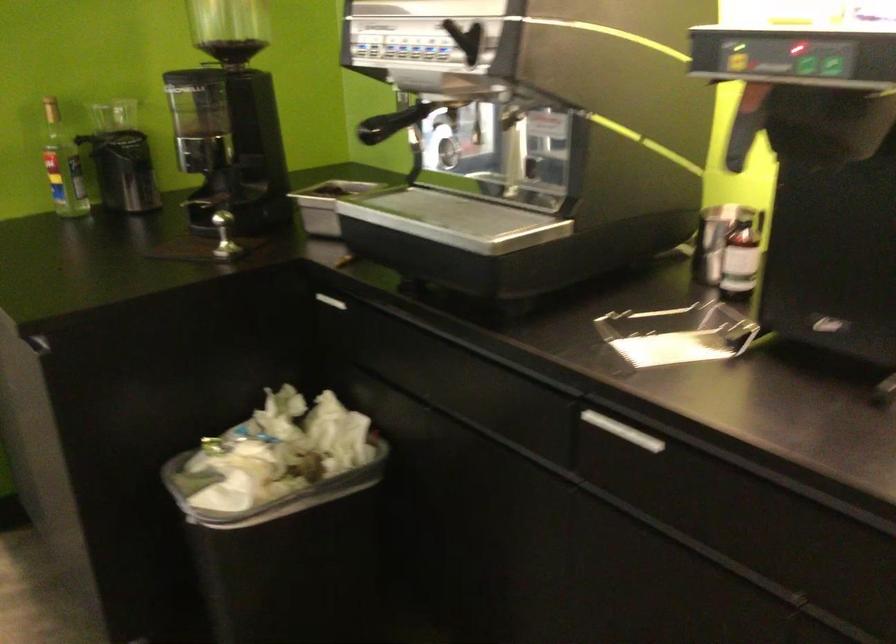
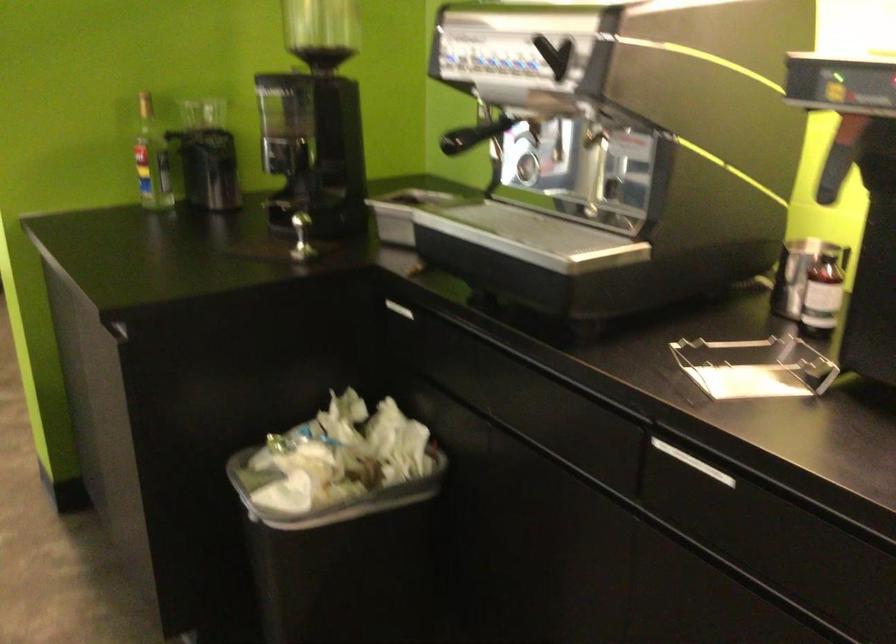
In the second image, find the point that corresponds to pixel 400 118 in the first image.

(484, 131)